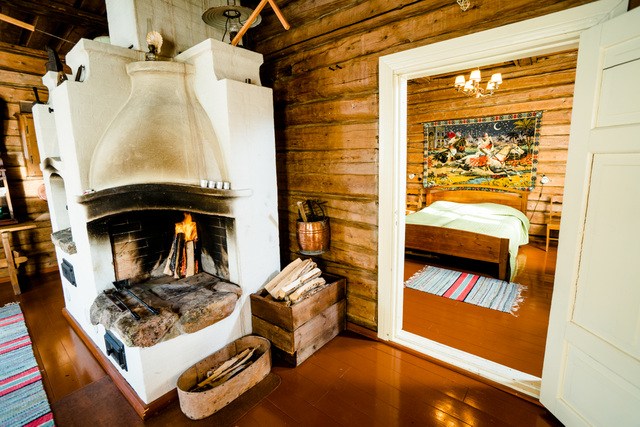
You are a GUI agent. You are given a task and a screenshot of the screen. Output one action in this format:
    pyautogui.click(x=<x>, y=<y>)
    Task: Click on the headboard
    
    Given the screenshot: What is the action you would take?
    pyautogui.click(x=472, y=196)